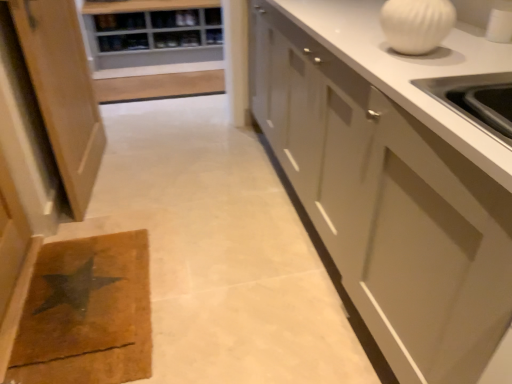
What are the coordinates of `free spot to the right of white glossy vase at upper right` in the screenshot? It's located at (454, 47).